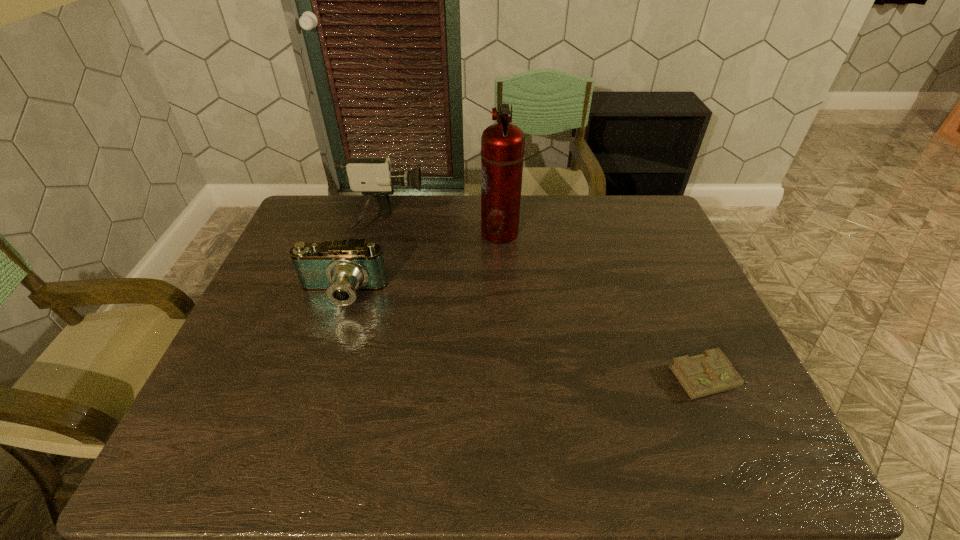
In the image, there is a desktop. At what (x,y) coordinates should I click in order to perform the action: click on vacant space at the left edge. Please return your answer as a coordinate pair (x, y). This screenshot has height=540, width=960. Looking at the image, I should click on (269, 363).

Where is `vacant region at the right edge`? The image size is (960, 540). vacant region at the right edge is located at coordinates (658, 281).

What are the coordinates of `vacant region at the far left corner of the desktop` in the screenshot? It's located at (324, 228).

Find the location of `vacant region at the far right corner`. vacant region at the far right corner is located at coordinates (625, 197).

Where is `free space between the diary and the third object from left to right`? Image resolution: width=960 pixels, height=540 pixels. free space between the diary and the third object from left to right is located at coordinates (605, 305).

Find the location of `free space between the fire extinguisher and the nearer camcorder`. free space between the fire extinguisher and the nearer camcorder is located at coordinates pyautogui.click(x=420, y=264).

Identify the location of free space between the diary and the tallest object. [605, 305].

This screenshot has width=960, height=540. In order to click on unoccupied area between the taller camcorder and the second object from right to left in this screenshot , I will do pyautogui.click(x=442, y=228).

Locate an element on the screen. This screenshot has height=540, width=960. free space between the diary and the second tallest object is located at coordinates (546, 301).

Where is `free spot between the second tallest object and the second object from right to left`? Image resolution: width=960 pixels, height=540 pixels. free spot between the second tallest object and the second object from right to left is located at coordinates (442, 228).